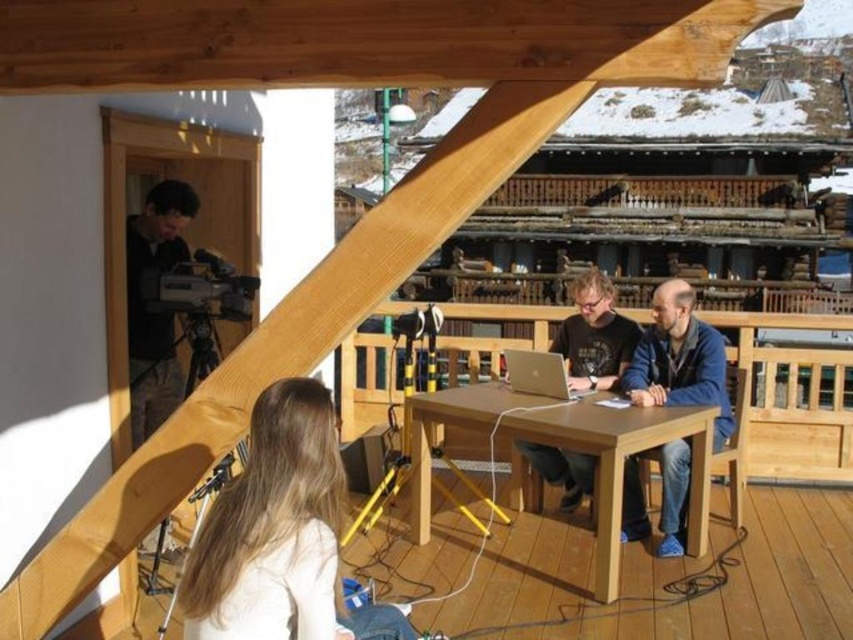
Question: In this image, where is light brown hair at lower center located relative to light brown wooden table at center?

Choices:
 (A) below
 (B) above

Answer: (B)

Question: Estimate the real-world distances between objects in this image. Which object is closer to the silver metallic laptop at center?

Choices:
 (A) light brown hair at lower center
 (B) blue denim jeans at lower right
 (C) light brown wooden table at center

Answer: (C)

Question: Among these objects, which one is farthest from the camera?

Choices:
 (A) blue denim jeans at lower right
 (B) matte black shirt at center

Answer: (B)

Question: Which point is farther from the camera taking this photo?

Choices:
 (A) (426, 499)
 (B) (235, 556)
 (C) (532, 388)
 (D) (541, 465)

Answer: (D)

Question: Is light brown hair at lower center to the right of light brown wooden table at center from the viewer's perspective?

Choices:
 (A) no
 (B) yes

Answer: (A)

Question: Can you confirm if light brown wooden table at center is positioned to the left of matte black shirt at center?

Choices:
 (A) yes
 (B) no

Answer: (A)